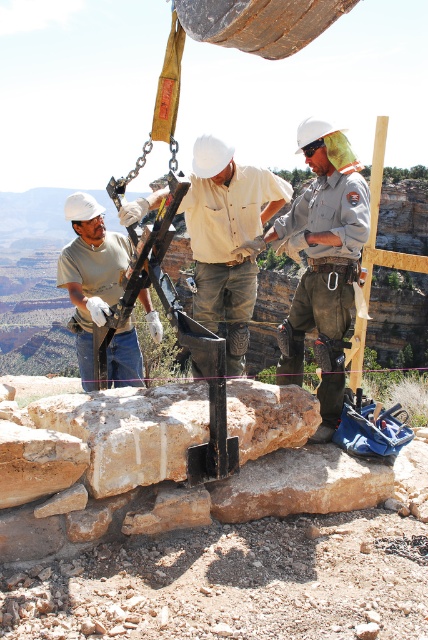
You are a safety inspector at the construction site. You notice the khaki uniform at center and the matte black tool at left. According to safety protocols, tools must be placed above workers to prevent falling hazards. Is the current arrangement compliant?

The khaki uniform at center is positioned under the matte black tool at left, which violates safety protocols as tools should be placed above workers to avoid falling risks.

You are a safety inspector assessing the scene. You notice two items of concern labeled as khaki uniform at center and matte black tool at left. According to safety protocols, the khaki uniform should be positioned to the right of the matte black tool. Does the current arrangement comply with safety standards?

Yes, the khaki uniform at center is positioned on the right side of matte black tool at left, which aligns with the required safety protocol.